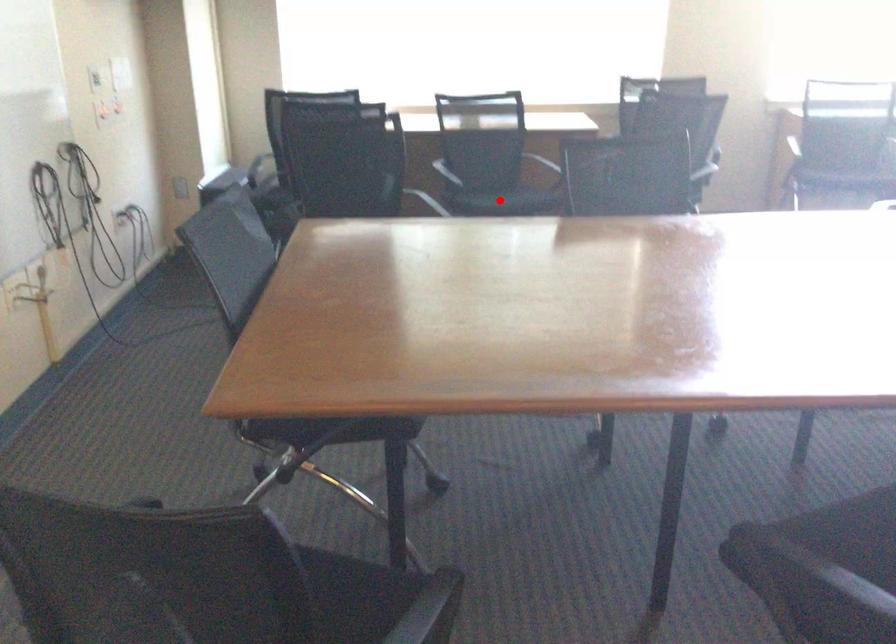
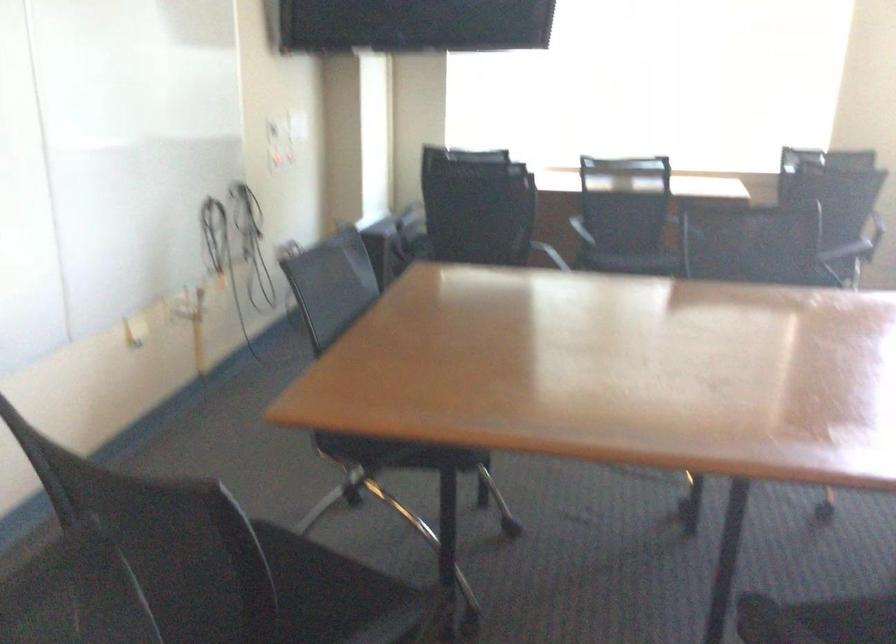
The point at the highlighted location is marked in the first image. Where is the corresponding point in the second image?

(633, 260)